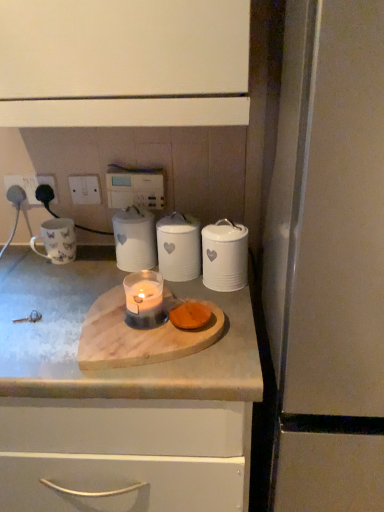
At what (x,y) coordinates should I click in order to perform the action: click on vacant area that is in front of matte white mug at left. Please return your answer as a coordinate pair (x, y). This screenshot has height=512, width=384. Looking at the image, I should click on (46, 287).